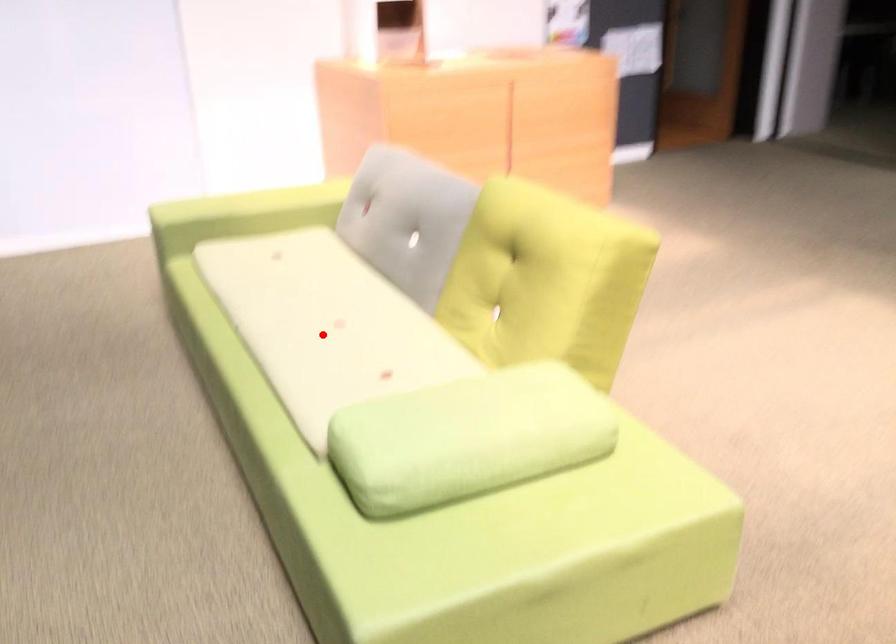
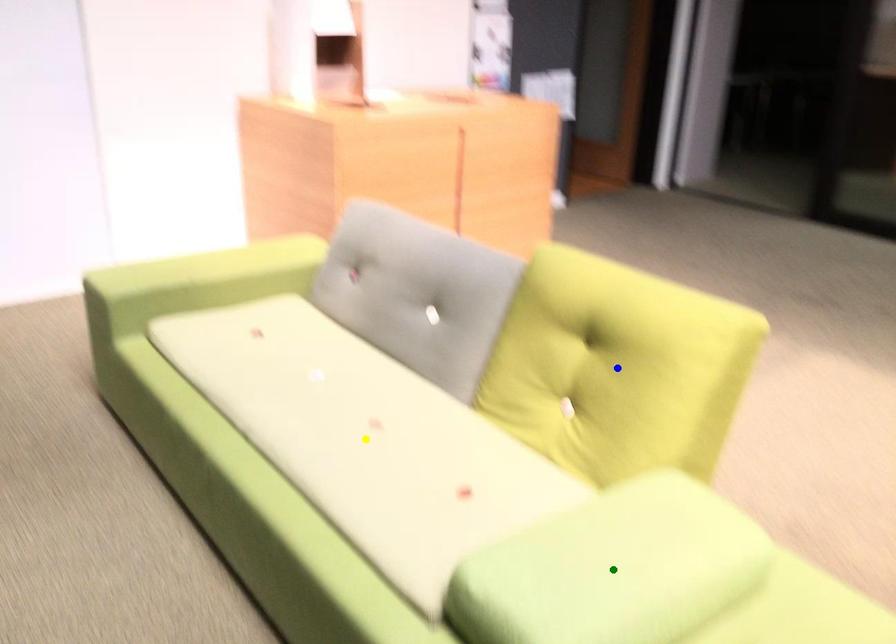
Question: I am providing you with two images of the same scene from different viewpoints. A red point is marked on the first image. You are given multiple points on the second image. Which mark in image 2 goes with the point in image 1?

Choices:
 (A) green point
 (B) blue point
 (C) yellow point

Answer: (C)